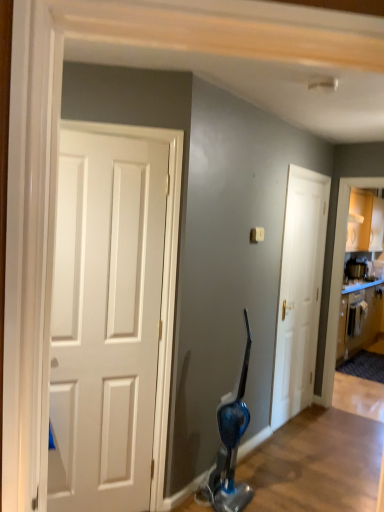
Question: Is white matte door at center wider or thinner than metallic silver toaster at upper right?

Choices:
 (A) thin
 (B) wide

Answer: (A)

Question: Would you say white matte door at center is inside or outside metallic silver toaster at upper right?

Choices:
 (A) inside
 (B) outside

Answer: (B)

Question: Estimate the real-world distances between objects in this image. Which object is farther from the wooden cabinet at right?

Choices:
 (A) metallic silver toaster at upper right
 (B) white matte door at center

Answer: (B)

Question: Which is farther from the metallic silver toaster at upper right?

Choices:
 (A) wooden cabinet at right
 (B) white matte door at center

Answer: (B)